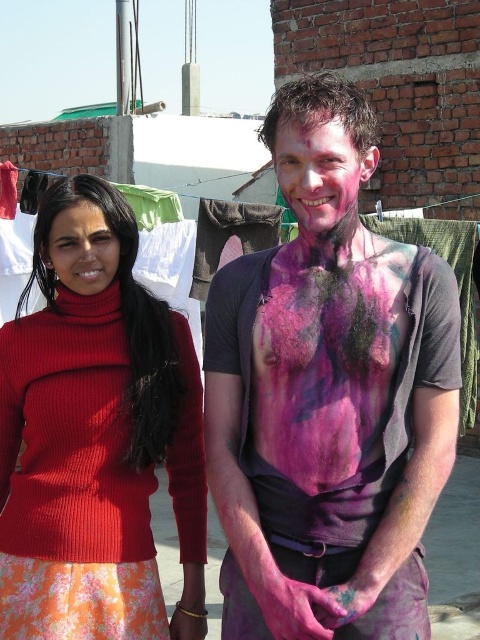
You are standing in the residential area shown in the image. You see a point at coordinates (x=96, y=428). Which object from the list below is located at that point? The options are the knitted red sweater at left and the colorful pink and purple powder on the right.

The point at coordinates (x=96, y=428) corresponds to the knitted red sweater at left.

You are a photographer trying to capture a portrait of the painted skin body at center and the pink matte face at center. Which object will appear wider in the photo?

The painted skin body at center will appear wider in the photo since its width is larger than the pink matte face at center.

You are a photographer trying to capture a portrait of both the knitted red sweater at left and the pink matte face at center. Since you want to include both in the frame, which direction should you move your camera to ensure both are visible?

You should move the camera to the right to include both the knitted red sweater at left and the pink matte face at center in the frame, as the knitted red sweater at left is positioned to the left of the pink matte face at center.